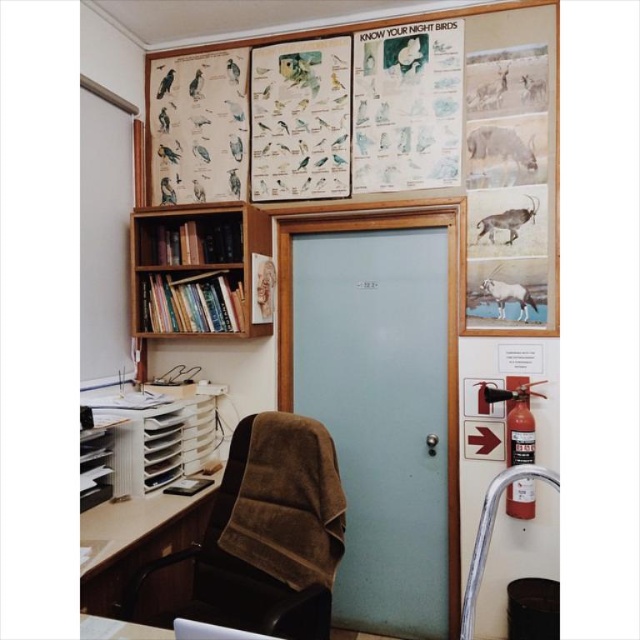
Does point (474, 145) come behind point (504, 224)?

Yes, point (474, 145) is behind point (504, 224).

Image resolution: width=640 pixels, height=640 pixels. What are the coordinates of `white textured antelope at upper right` in the screenshot? It's located at (500, 145).

Find the location of a particular element. white textured antelope at upper right is located at coordinates (500, 145).

Does light brown wood desk at lower left have a lesser width compared to white glossy antelope at right?

In fact, light brown wood desk at lower left might be wider than white glossy antelope at right.

Where is `light brown wood desk at lower left`? The width and height of the screenshot is (640, 640). light brown wood desk at lower left is located at coordinates (141, 547).

This screenshot has width=640, height=640. What are the coordinates of `light brown wood desk at lower left` in the screenshot? It's located at (141, 547).

Between white plastic trays at lower left and white textured antelope at upper right, which one has less height?

white textured antelope at upper right is shorter.

Is white plastic trays at lower left below white textured antelope at upper right?

Indeed, white plastic trays at lower left is positioned under white textured antelope at upper right.

Image resolution: width=640 pixels, height=640 pixels. In order to click on white plastic trays at lower left in this screenshot , I will do `click(156, 433)`.

Find the location of a particular element. The width and height of the screenshot is (640, 640). white plastic trays at lower left is located at coordinates (156, 433).